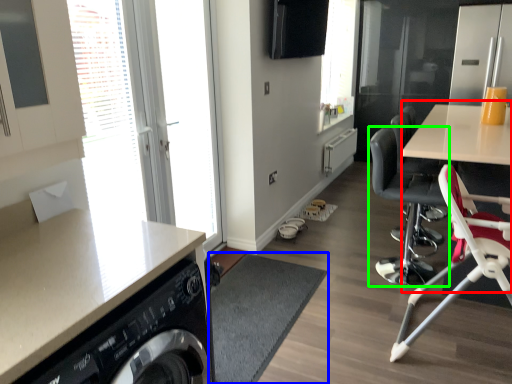
Question: Estimate the real-world distances between objects in this image. Which object is farther from computer desk (highlighted by a red box), flat (highlighted by a blue box) or chair (highlighted by a green box)?

Choices:
 (A) flat
 (B) chair

Answer: (A)